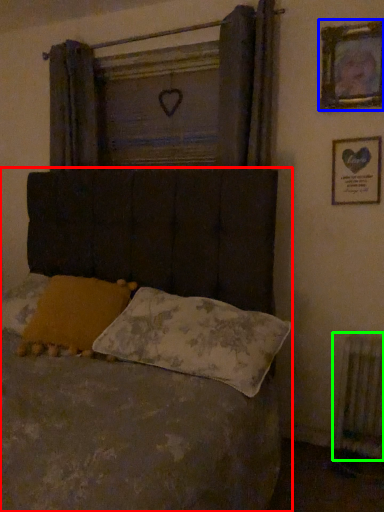
Question: Which object is the closest to the bed (highlighted by a red box)? Choose among these: picture frame (highlighted by a blue box) or radiator (highlighted by a green box).

Choices:
 (A) picture frame
 (B) radiator

Answer: (A)